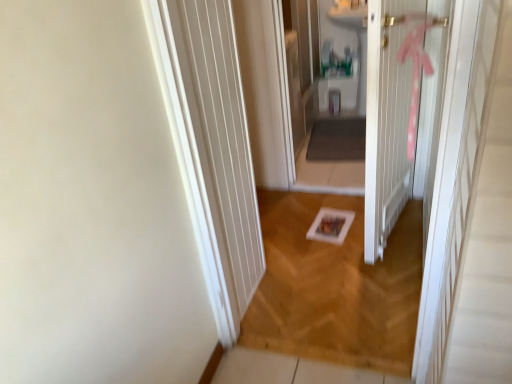
Question: From the image's perspective, is matte white sink at center on top of wooden frame at center?

Choices:
 (A) yes
 (B) no

Answer: (A)

Question: Is matte white sink at center thinner than wooden frame at center?

Choices:
 (A) yes
 (B) no

Answer: (A)

Question: Is wooden frame at center completely or partially inside matte white sink at center?

Choices:
 (A) no
 (B) yes

Answer: (A)

Question: Is matte white sink at center aimed at wooden frame at center?

Choices:
 (A) yes
 (B) no

Answer: (A)

Question: From a real-world perspective, does matte white sink at center stand above wooden frame at center?

Choices:
 (A) no
 (B) yes

Answer: (B)

Question: Is wooden frame at center inside or outside of matte white sink at center?

Choices:
 (A) inside
 (B) outside

Answer: (B)

Question: Based on their positions, is wooden frame at center located to the left or right of matte white sink at center?

Choices:
 (A) left
 (B) right

Answer: (A)

Question: From a real-world perspective, is wooden frame at center above or below matte white sink at center?

Choices:
 (A) below
 (B) above

Answer: (A)

Question: Considering the positions of wooden frame at center and matte white sink at center in the image, is wooden frame at center bigger or smaller than matte white sink at center?

Choices:
 (A) small
 (B) big

Answer: (A)

Question: Is white wooden door at center spatially inside wooden frame at center, or outside of it?

Choices:
 (A) inside
 (B) outside

Answer: (B)

Question: Considering the positions of white wooden door at center and wooden frame at center in the image, is white wooden door at center taller or shorter than wooden frame at center?

Choices:
 (A) tall
 (B) short

Answer: (A)

Question: Considering the positions of white wooden door at center and wooden frame at center in the image, is white wooden door at center wider or thinner than wooden frame at center?

Choices:
 (A) thin
 (B) wide

Answer: (A)

Question: From a real-world perspective, is white wooden door at center positioned above or below wooden frame at center?

Choices:
 (A) below
 (B) above

Answer: (B)

Question: Based on their positions, is wooden frame at center located to the left or right of white wooden door at center?

Choices:
 (A) right
 (B) left

Answer: (B)

Question: From the image's perspective, relative to white wooden door at center, is wooden frame at center above or below?

Choices:
 (A) below
 (B) above

Answer: (A)